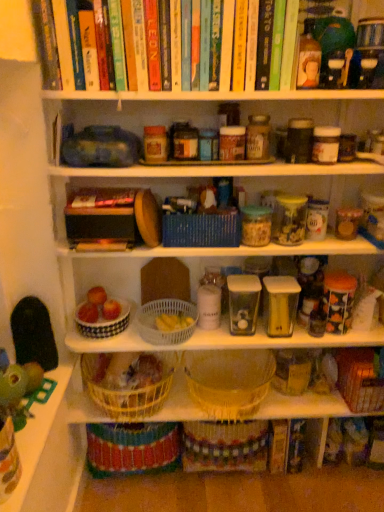
Question: Is white ceramic bowl at center, which is the 1th basket from left to right, touching woven straw basket at center, marked as the 5th basket in a left-to-right arrangement?

Choices:
 (A) no
 (B) yes

Answer: (A)

Question: Does white ceramic bowl at center, the sixth basket when ordered from right to left, have a lesser height compared to woven straw basket at center, marked as the 5th basket in a left-to-right arrangement?

Choices:
 (A) no
 (B) yes

Answer: (B)

Question: Is white ceramic bowl at center, which is the 1th basket from left to right, far away from woven straw basket at center, marked as the 5th basket in a left-to-right arrangement?

Choices:
 (A) no
 (B) yes

Answer: (A)

Question: From the image's perspective, would you say white ceramic bowl at center, which is the 1th basket from left to right, is shown under woven straw basket at center, which is the second basket from right to left?

Choices:
 (A) no
 (B) yes

Answer: (A)

Question: Does white ceramic bowl at center, the sixth basket when ordered from right to left, contain woven straw basket at center, marked as the 5th basket in a left-to-right arrangement?

Choices:
 (A) no
 (B) yes

Answer: (A)

Question: Is woven straw basket at center, marked as the 5th basket in a left-to-right arrangement, situated inside hardcover book at center or outside?

Choices:
 (A) outside
 (B) inside

Answer: (A)

Question: Is woven straw basket at center, marked as the 5th basket in a left-to-right arrangement, taller or shorter than hardcover book at center?

Choices:
 (A) tall
 (B) short

Answer: (A)

Question: Would you say woven straw basket at center, marked as the 5th basket in a left-to-right arrangement, is to the left or to the right of hardcover book at center in the picture?

Choices:
 (A) left
 (B) right

Answer: (B)

Question: In the image, is woven straw basket at center, which is the second basket from right to left, positioned in front of or behind hardcover book at center?

Choices:
 (A) behind
 (B) front

Answer: (A)

Question: Based on their positions, is white ceramic bowl at center, which is the 1th basket from left to right, located to the left or right of hardcover book at center?

Choices:
 (A) right
 (B) left

Answer: (B)

Question: From a real-world perspective, relative to hardcover book at center, is white ceramic bowl at center, which is the 1th basket from left to right, vertically above or below?

Choices:
 (A) below
 (B) above

Answer: (A)

Question: Considering the positions of white ceramic bowl at center, which is the 1th basket from left to right, and hardcover book at center in the image, is white ceramic bowl at center, which is the 1th basket from left to right, wider or thinner than hardcover book at center?

Choices:
 (A) wide
 (B) thin

Answer: (A)

Question: Considering the positions of point (99, 328) and point (99, 203), is point (99, 328) closer or farther from the camera than point (99, 203)?

Choices:
 (A) farther
 (B) closer

Answer: (A)

Question: In the image, is white plastic basket at center, acting as the fourth basket starting from the right, positioned in front of or behind hardcover book at center?

Choices:
 (A) front
 (B) behind

Answer: (B)

Question: Considering the relative positions of white plastic basket at center, acting as the fourth basket starting from the right, and hardcover book at center in the image provided, is white plastic basket at center, acting as the fourth basket starting from the right, to the left or to the right of hardcover book at center?

Choices:
 (A) right
 (B) left

Answer: (A)